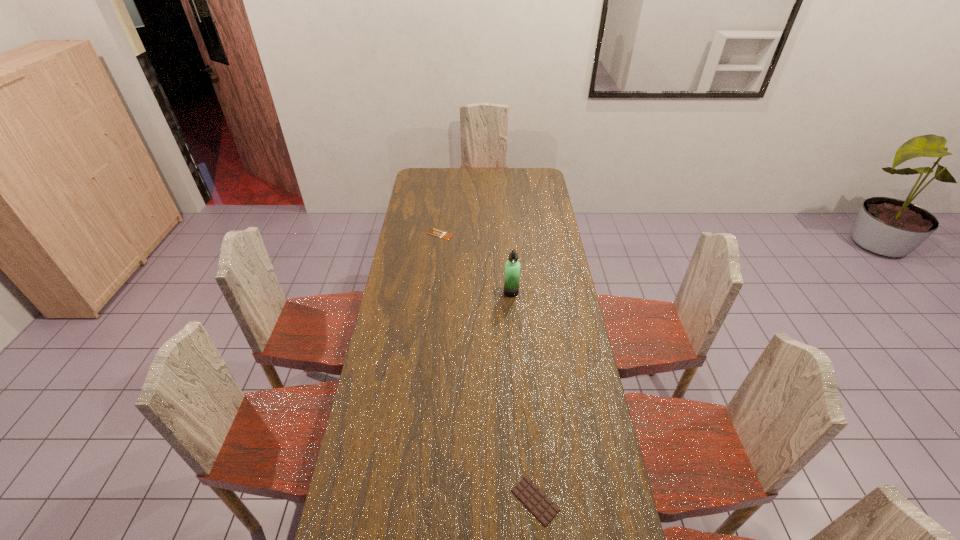
In the image, there is a desktop. Where is `free space at the far edge`? free space at the far edge is located at coordinates (492, 187).

This screenshot has height=540, width=960. In the image, there is a desktop. Find the location of `vacant space at the left edge`. vacant space at the left edge is located at coordinates (407, 327).

Image resolution: width=960 pixels, height=540 pixels. In the image, there is a desktop. Find the location of `vacant space at the right edge`. vacant space at the right edge is located at coordinates point(609,480).

The width and height of the screenshot is (960, 540). In order to click on blank area at the far left corner in this screenshot , I will do `click(432, 173)`.

At what (x,y) coordinates should I click in order to perform the action: click on free point between the shorter chocolate bar and the second farthest object. Please return your answer as a coordinate pair (x, y). This screenshot has width=960, height=540. Looking at the image, I should click on (476, 263).

Locate an element on the screen. The image size is (960, 540). vacant space that is in between the second tallest object and the leftmost object is located at coordinates (488, 367).

Find the location of a particular element. The width and height of the screenshot is (960, 540). unoccupied area between the nearer chocolate bar and the farthest object is located at coordinates (488, 367).

Identify the location of blank region between the second farthest object and the shortest object. (476, 263).

Identify the location of free spot between the left chocolate bar and the second shortest object. (488, 367).

Image resolution: width=960 pixels, height=540 pixels. In order to click on free space between the leftmost object and the tallest object in this screenshot , I will do `click(476, 263)`.